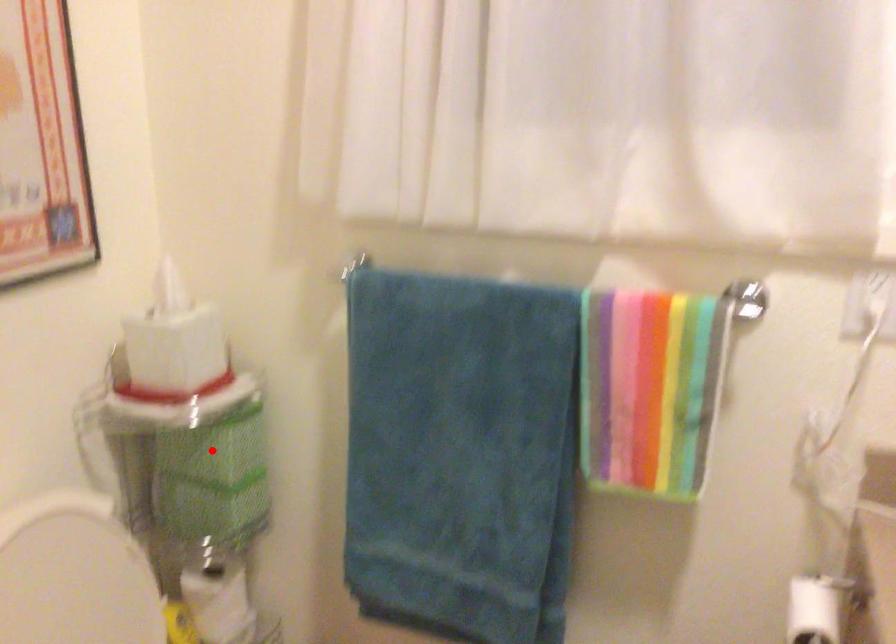
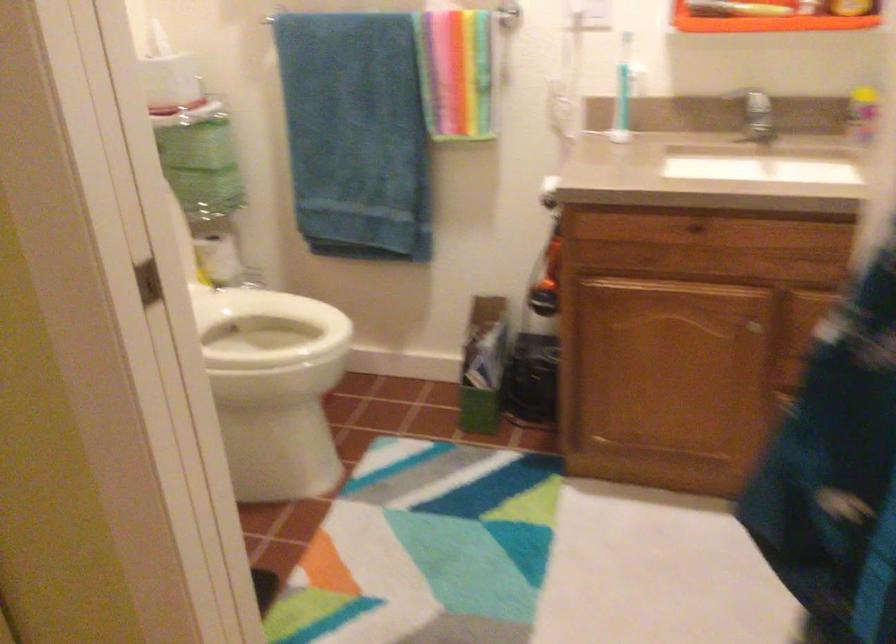
Question: A red point is marked in image1. In image2, is the corresponding 3D point closer to the camera or farther? Reply with the corresponding letter.

Choices:
 (A) The corresponding 3D point is closer.
 (B) The corresponding 3D point is farther.

Answer: (B)